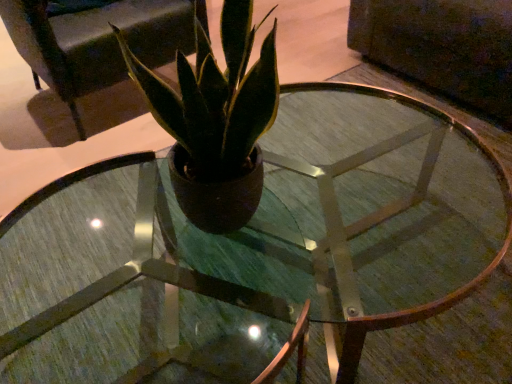
Question: Can you confirm if matte brown pot at center is bigger than matte black armchair at upper center?

Choices:
 (A) no
 (B) yes

Answer: (A)

Question: Is matte black armchair at upper center completely or partially inside matte brown pot at center?

Choices:
 (A) yes
 (B) no

Answer: (B)

Question: From the image's perspective, does matte brown pot at center appear higher than matte black armchair at upper center?

Choices:
 (A) yes
 (B) no

Answer: (B)

Question: Is matte brown pot at center to the right of matte black armchair at upper center from the viewer's perspective?

Choices:
 (A) no
 (B) yes

Answer: (B)

Question: Are matte brown pot at center and matte black armchair at upper center far apart?

Choices:
 (A) yes
 (B) no

Answer: (A)

Question: Is matte brown pot at center oriented towards matte black armchair at upper center?

Choices:
 (A) no
 (B) yes

Answer: (B)

Question: Is matte black armchair at upper center aimed at matte brown pot at center?

Choices:
 (A) no
 (B) yes

Answer: (B)

Question: Can you confirm if matte black armchair at upper center is shorter than matte brown pot at center?

Choices:
 (A) no
 (B) yes

Answer: (A)

Question: Can you confirm if matte black armchair at upper center is smaller than matte brown pot at center?

Choices:
 (A) no
 (B) yes

Answer: (A)

Question: Considering the relative sizes of matte black armchair at upper center and matte brown pot at center in the image provided, is matte black armchair at upper center taller than matte brown pot at center?

Choices:
 (A) yes
 (B) no

Answer: (A)

Question: From the image's perspective, is matte black armchair at upper center beneath matte brown pot at center?

Choices:
 (A) yes
 (B) no

Answer: (B)

Question: Is the position of matte black armchair at upper center more distant than that of matte brown pot at center?

Choices:
 (A) yes
 (B) no

Answer: (A)

Question: Is matte black armchair at upper center bigger or smaller than matte brown pot at center?

Choices:
 (A) small
 (B) big

Answer: (B)